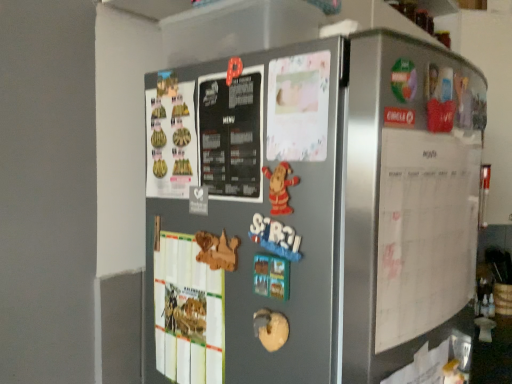
Question: Is white paper calendar at right not within satin silver fridge at center?

Choices:
 (A) no
 (B) yes

Answer: (B)

Question: Is white paper calendar at right further to the viewer compared to satin silver fridge at center?

Choices:
 (A) no
 (B) yes

Answer: (B)

Question: Is white paper calendar at right to the left of satin silver fridge at center from the viewer's perspective?

Choices:
 (A) yes
 (B) no

Answer: (B)

Question: Considering the relative sizes of white paper calendar at right and satin silver fridge at center in the image provided, is white paper calendar at right wider than satin silver fridge at center?

Choices:
 (A) yes
 (B) no

Answer: (B)

Question: Is white paper calendar at right surrounding satin silver fridge at center?

Choices:
 (A) yes
 (B) no

Answer: (B)

Question: Is white paper calendar at right at the right side of satin silver fridge at center?

Choices:
 (A) no
 (B) yes

Answer: (B)

Question: Does satin silver fridge at center have a lesser width compared to white paper calendar at right?

Choices:
 (A) no
 (B) yes

Answer: (A)

Question: Considering the relative sizes of satin silver fridge at center and white paper calendar at right in the image provided, is satin silver fridge at center smaller than white paper calendar at right?

Choices:
 (A) no
 (B) yes

Answer: (A)

Question: Is satin silver fridge at center shorter than white paper calendar at right?

Choices:
 (A) no
 (B) yes

Answer: (A)

Question: Is satin silver fridge at center in front of white paper calendar at right?

Choices:
 (A) no
 (B) yes

Answer: (B)

Question: From the image's perspective, is satin silver fridge at center under white paper calendar at right?

Choices:
 (A) no
 (B) yes

Answer: (B)

Question: Is satin silver fridge at center placed right next to white paper calendar at right?

Choices:
 (A) no
 (B) yes

Answer: (A)

Question: Considering the positions of point (159, 379) and point (376, 337), is point (159, 379) closer or farther from the camera than point (376, 337)?

Choices:
 (A) farther
 (B) closer

Answer: (A)